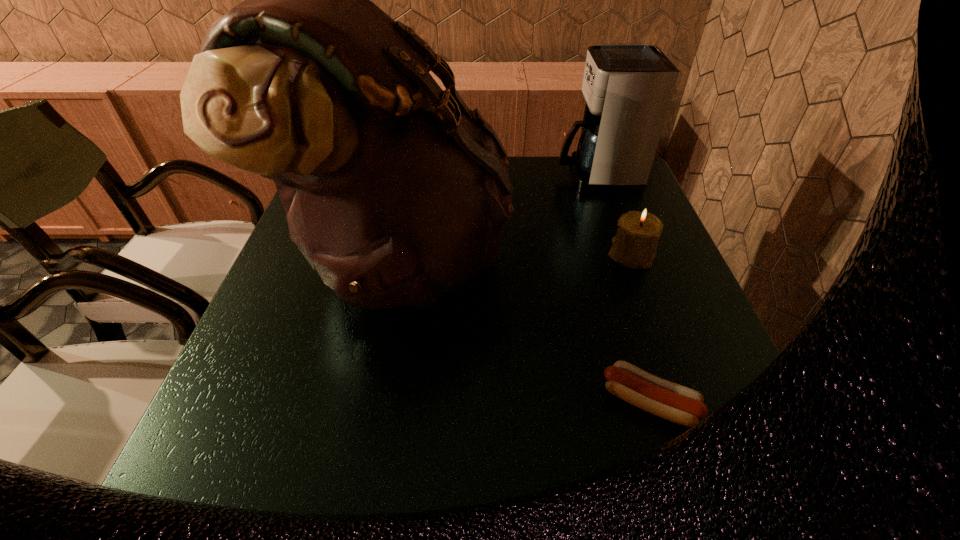
The height and width of the screenshot is (540, 960). Identify the location of satchel. [x=396, y=192].

The width and height of the screenshot is (960, 540). What are the coordinates of `the tallest object` in the screenshot? It's located at (396, 192).

Find the location of a particular element. coffee maker is located at coordinates (628, 87).

Locate an element on the screen. This screenshot has width=960, height=540. candle_holder is located at coordinates (634, 246).

Where is `the nearest object`? This screenshot has height=540, width=960. the nearest object is located at coordinates (682, 405).

Identify the location of the shortest object. (682, 405).

The width and height of the screenshot is (960, 540). Find the location of `vacant space situated 0.330m at the front of the satchel with buckles`. vacant space situated 0.330m at the front of the satchel with buckles is located at coordinates (647, 258).

Locate an element on the screen. vacant area situated 0.300m on the front panel of the coffee maker is located at coordinates 457,176.

Image resolution: width=960 pixels, height=540 pixels. I want to click on vacant space situated 0.100m on the front panel of the coffee maker, so click(524, 176).

The image size is (960, 540). I want to click on vacant area located 0.370m on the front panel of the coffee maker, so click(433, 176).